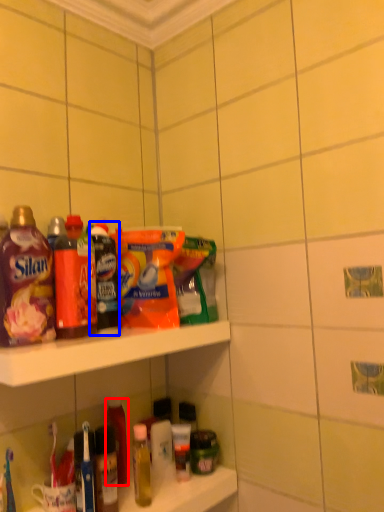
Question: Which point is closer to the camera, bottle (highlighted by a red box) or product (highlighted by a blue box)?

Choices:
 (A) bottle
 (B) product

Answer: (B)